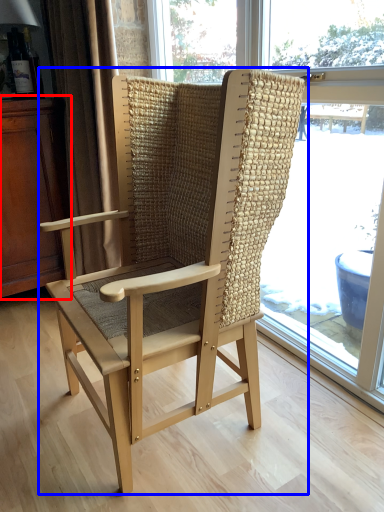
Question: Which object appears farthest to the camera in this image, dresser (highlighted by a red box) or chair (highlighted by a blue box)?

Choices:
 (A) dresser
 (B) chair

Answer: (A)